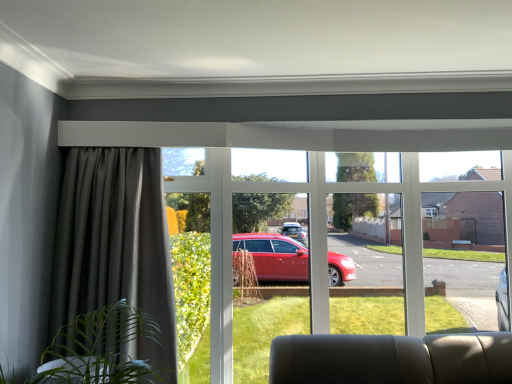
The image size is (512, 384). In order to click on dark grey textured curtain at left in this screenshot , I will do pos(115,244).

What do you see at coordinates (115, 244) in the screenshot? I see `dark grey textured curtain at left` at bounding box center [115, 244].

This screenshot has width=512, height=384. Find the location of `clear glass window at center`. clear glass window at center is located at coordinates coord(316,235).

This screenshot has height=384, width=512. What do you see at coordinates (316, 235) in the screenshot?
I see `clear glass window at center` at bounding box center [316, 235].

Measure the distance between clear glass window at center and camera.

The distance of clear glass window at center from camera is 2.63 meters.

Image resolution: width=512 pixels, height=384 pixels. I want to click on dark grey textured curtain at left, so click(115, 244).

Which is more to the right, dark grey textured curtain at left or clear glass window at center?

clear glass window at center.

Which object is closer to the camera, dark grey textured curtain at left or clear glass window at center?

dark grey textured curtain at left is in front.

Is point (158, 318) closer or farther from the camera than point (315, 291)?

Point (158, 318).

From the image's perspective, is dark grey textured curtain at left under clear glass window at center?

No, from the image's perspective, dark grey textured curtain at left is not beneath clear glass window at center.

From a real-world perspective, between dark grey textured curtain at left and clear glass window at center, who is vertically higher?

From a 3D spatial view, dark grey textured curtain at left is above.

Is dark grey textured curtain at left wider or thinner than clear glass window at center?

Considering their sizes, dark grey textured curtain at left looks slimmer than clear glass window at center.

Between dark grey textured curtain at left and clear glass window at center, which one has more height?

clear glass window at center.

Is dark grey textured curtain at left smaller than clear glass window at center?

Yes, dark grey textured curtain at left is smaller than clear glass window at center.

From the picture: Is dark grey textured curtain at left not within clear glass window at center?

Yes, dark grey textured curtain at left is located beyond the bounds of clear glass window at center.

Are dark grey textured curtain at left and clear glass window at center located far from each other?

dark grey textured curtain at left is near clear glass window at center, not far away.

Is dark grey textured curtain at left facing away from clear glass window at center?

No, dark grey textured curtain at left's orientation is not away from clear glass window at center.

What's the angular difference between dark grey textured curtain at left and clear glass window at center's facing directions?

The angular difference between dark grey textured curtain at left and clear glass window at center is 1.31 degrees.

The width and height of the screenshot is (512, 384). What are the coordinates of `window below the dark grey textured curtain at left (from the image's perspective)` in the screenshot? It's located at (316, 235).

Is clear glass window at center at the left side of dark grey textured curtain at left?

No, clear glass window at center is not to the left of dark grey textured curtain at left.

Between clear glass window at center and dark grey textured curtain at left, which one is positioned in front?

dark grey textured curtain at left is closer to the camera.

Does point (216, 381) lie in front of point (153, 268)?

No, (216, 381) is behind (153, 268).

From the image's perspective, is clear glass window at center over dark grey textured curtain at left?

No, from the image's perspective, clear glass window at center is not above dark grey textured curtain at left.

From a real-world perspective, between clear glass window at center and dark grey textured curtain at left, who is vertically lower?

clear glass window at center is physically lower.

Considering the relative sizes of clear glass window at center and dark grey textured curtain at left in the image provided, is clear glass window at center wider than dark grey textured curtain at left?

Yes.

Which of these two, clear glass window at center or dark grey textured curtain at left, stands shorter?

dark grey textured curtain at left is shorter.

Between clear glass window at center and dark grey textured curtain at left, which one has larger size?

Bigger between the two is clear glass window at center.

Choose the correct answer: Is clear glass window at center inside dark grey textured curtain at left or outside it?

The correct answer is: outside.

Is there a large distance between clear glass window at center and dark grey textured curtain at left?

clear glass window at center is actually quite close to dark grey textured curtain at left.

Does clear glass window at center turn towards dark grey textured curtain at left?

Yes, clear glass window at center is facing dark grey textured curtain at left.

What's the angular difference between clear glass window at center and dark grey textured curtain at left's facing directions?

The angular difference between clear glass window at center and dark grey textured curtain at left is 1.31 degrees.

How distant is clear glass window at center from dark grey textured curtain at left?

clear glass window at center is 26.14 inches from dark grey textured curtain at left.

This screenshot has height=384, width=512. What are the coordinates of `window below the dark grey textured curtain at left (from a real-world perspective)` in the screenshot? It's located at coord(316,235).

Find the location of a particular element. window that appears behind the dark grey textured curtain at left is located at coordinates (316, 235).

Identify the location of window that is on the right side of dark grey textured curtain at left. The width and height of the screenshot is (512, 384). (316, 235).